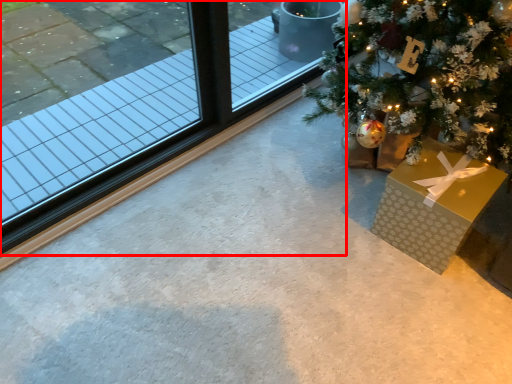
Question: From the image's perspective, where is window (annotated by the red box) located in relation to gift box in the image?

Choices:
 (A) above
 (B) below

Answer: (A)